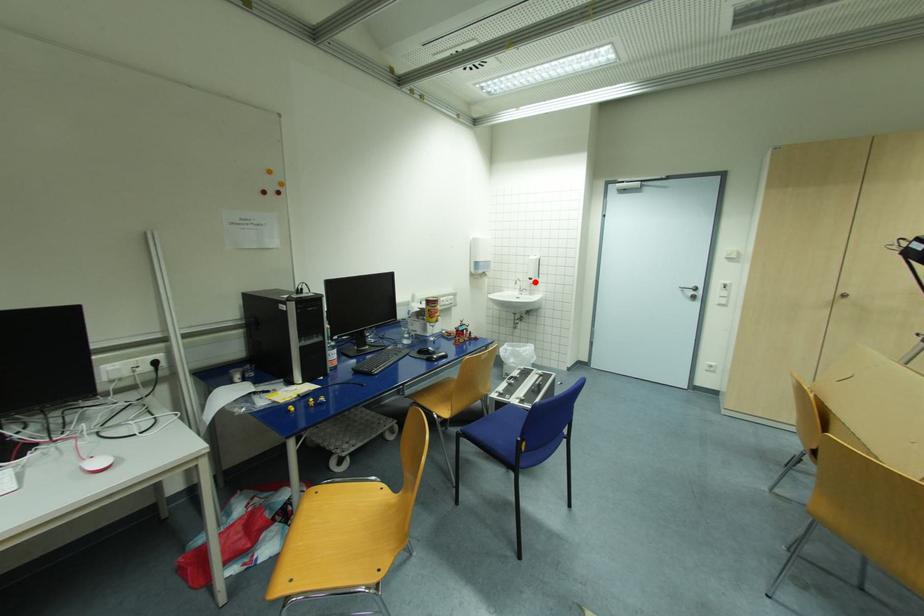
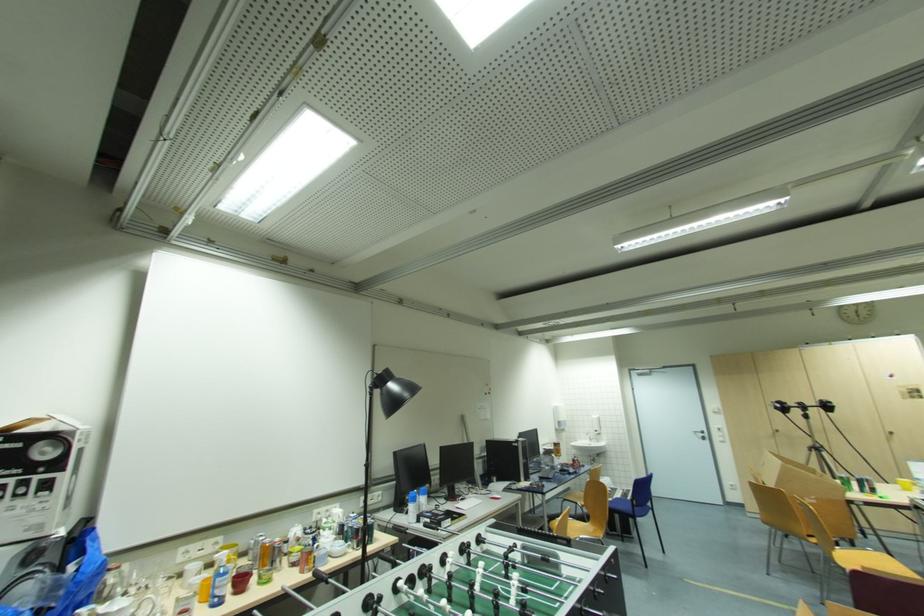
Question: I am providing you with two images of the same scene from different viewpoints. Image1 has a red point marked. In image2, the corresponding 3D location appears at what relative position? Reply with the corresponding letter.

Choices:
 (A) Closer
 (B) Farther

Answer: (B)